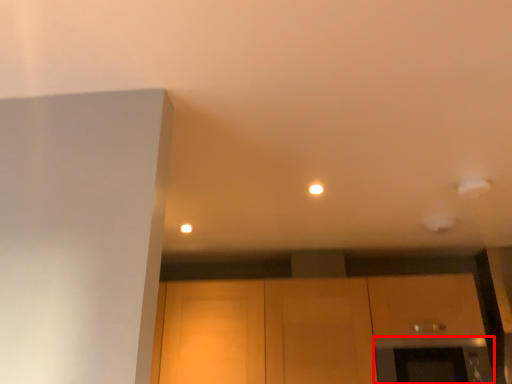
Question: Observing the image, what is the correct spatial positioning of oven (annotated by the red box) in reference to cabinetry?

Choices:
 (A) left
 (B) right

Answer: (B)